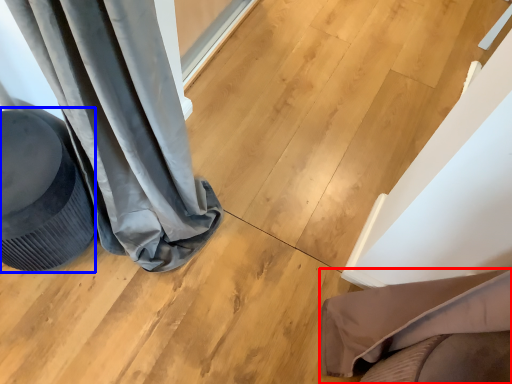
Question: Which object is closer to the camera taking this photo, furniture (highlighted by a red box) or swivel chair (highlighted by a blue box)?

Choices:
 (A) furniture
 (B) swivel chair

Answer: (A)